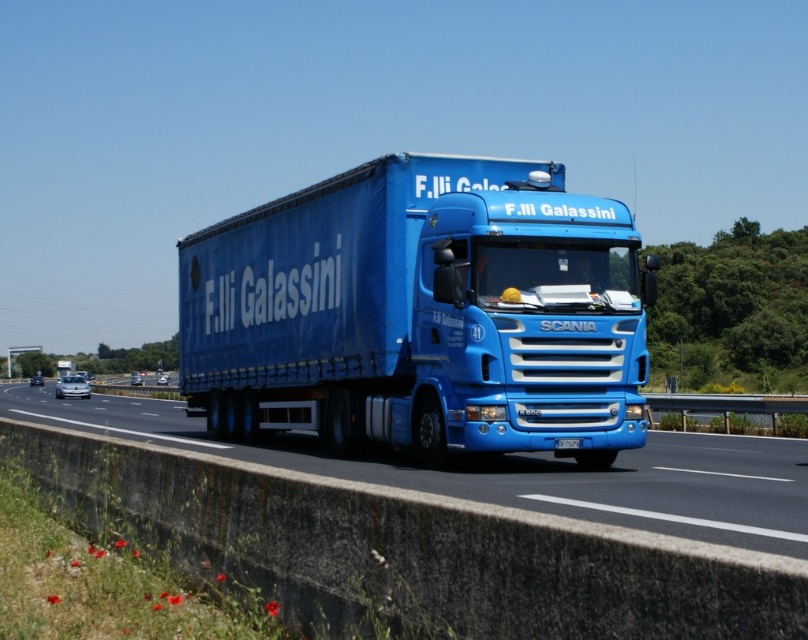
In the scene shown: Between blue matte trailer truck at center and blue metallic license plate at center, which one appears on the left side from the viewer's perspective?

Positioned to the left is blue matte trailer truck at center.

Does point (633, 292) lie behind point (562, 440)?

Yes.

This screenshot has height=640, width=808. Find the location of `blue matte trailer truck at center`. blue matte trailer truck at center is located at coordinates (423, 312).

Does blue metallic truck at center appear under blue metallic license plate at center?

Indeed, blue metallic truck at center is positioned under blue metallic license plate at center.

Can you confirm if blue metallic truck at center is smaller than blue metallic license plate at center?

No, blue metallic truck at center is not smaller than blue metallic license plate at center.

Is point (633, 500) closer to camera compared to point (562, 444)?

Yes.

The width and height of the screenshot is (808, 640). In order to click on blue metallic truck at center in this screenshot , I will do `click(516, 472)`.

Which of these two, blue matte trailer truck at center or blue metallic truck at center, stands shorter?

With less height is blue metallic truck at center.

Can you confirm if blue matte trailer truck at center is positioned below blue metallic truck at center?

Incorrect, blue matte trailer truck at center is not positioned below blue metallic truck at center.

Between point (390, 186) and point (802, 509), which one is positioned in front?

Positioned in front is point (802, 509).

This screenshot has height=640, width=808. Find the location of `blue matte trailer truck at center`. blue matte trailer truck at center is located at coordinates (423, 312).